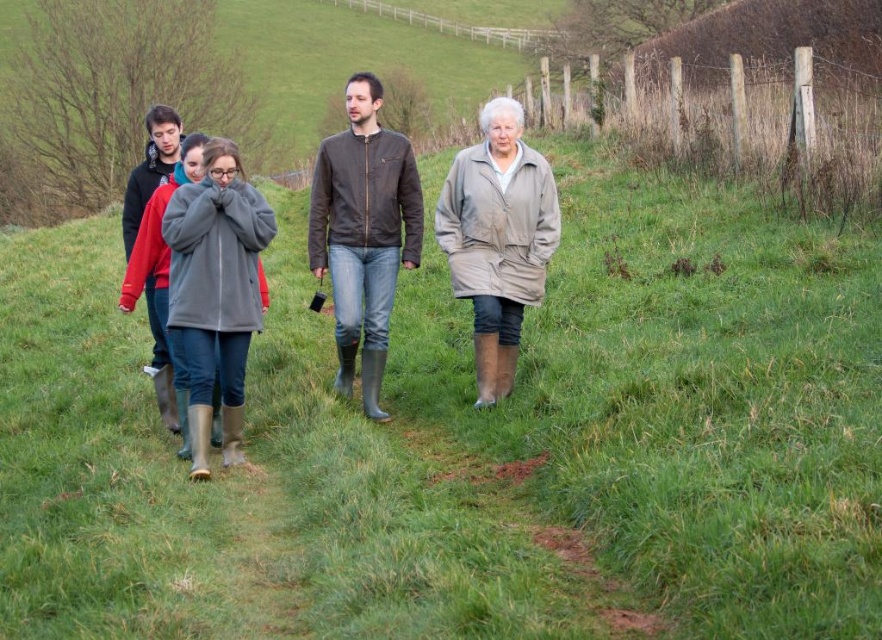
Question: Estimate the real-world distances between objects in this image. Which object is closer to the beige leather coat at center?

Choices:
 (A) gray fleece coat at center
 (B) brown leather jacket at center

Answer: (B)

Question: Among these objects, which one is nearest to the camera?

Choices:
 (A) brown leather jacket at center
 (B) gray fleece coat at center
 (C) rubber boots at center

Answer: (B)

Question: Is rubber boots at center behind brown leather jacket at center?

Choices:
 (A) no
 (B) yes

Answer: (A)

Question: Which point is farther from the camera taking this photo?

Choices:
 (A) (318, 228)
 (B) (243, 305)
 (C) (387, 163)
 (D) (544, 205)

Answer: (C)

Question: Can you confirm if rubber boots at center is positioned to the left of brown leather jacket at center?

Choices:
 (A) no
 (B) yes

Answer: (B)

Question: Does brown leather jacket at center have a greater width compared to beige leather coat at center?

Choices:
 (A) yes
 (B) no

Answer: (A)